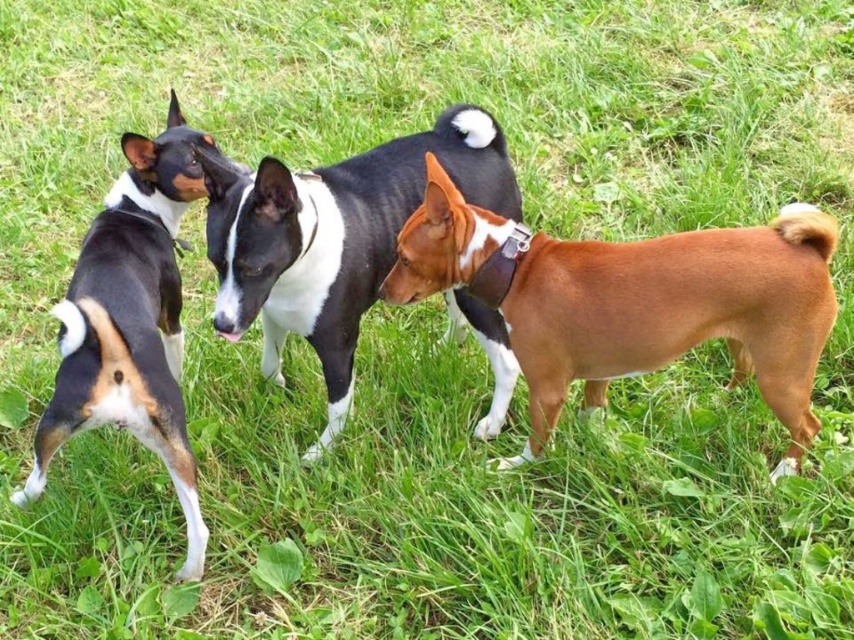
Is brown leather dog at center closer to the viewer compared to brown leather collar at center?

No, brown leather dog at center is further to the viewer.

Who is lower down, brown leather dog at center or brown leather collar at center?

brown leather dog at center

Between point (589, 387) and point (468, 132), which one is positioned behind?

Point (589, 387)

The image size is (854, 640). In order to click on brown leather dog at center in this screenshot , I will do `click(676, 314)`.

Between brown leather collar at center and black and white fur at left, which one has more height?

Standing taller between the two is black and white fur at left.

Which is more to the right, brown leather collar at center or black and white fur at left?

brown leather collar at center

Who is more distant from viewer, (279, 374) or (145, 422)?

The point (279, 374) is more distant.

Identify the location of brown leather collar at center. (334, 237).

Is point (109, 326) less distant than point (502, 248)?

Yes, it is.

Can you confirm if black and white fur at left is positioned to the right of brown leather neckband at center?

In fact, black and white fur at left is to the left of brown leather neckband at center.

Which is in front, point (178, 180) or point (493, 301)?

Positioned in front is point (493, 301).

Identify the location of black and white fur at left. (132, 321).